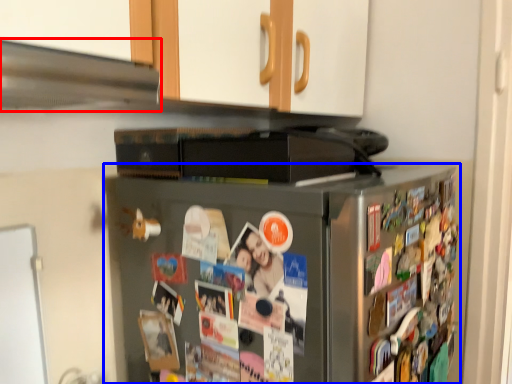
Question: Among these objects, which one is nearest to the camera, exhaust hood (highlighted by a red box) or refrigerator (highlighted by a blue box)?

Choices:
 (A) exhaust hood
 (B) refrigerator

Answer: (A)